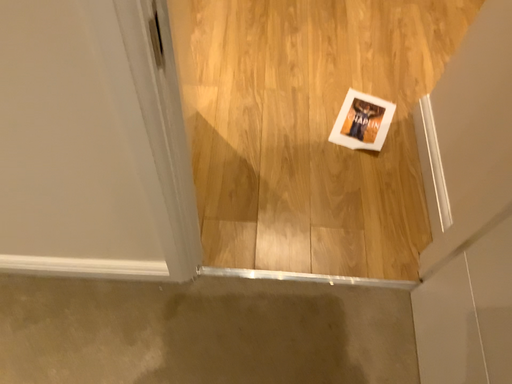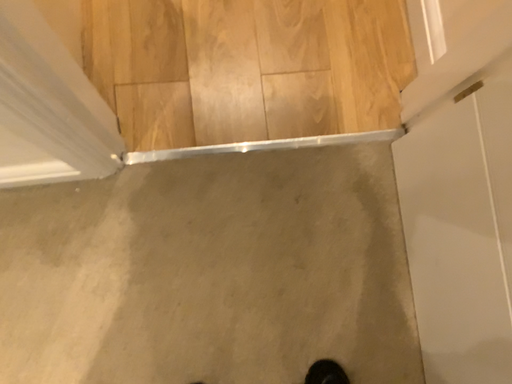
Question: How did the camera likely rotate when shooting the video?

Choices:
 (A) rotated upward
 (B) rotated downward

Answer: (B)